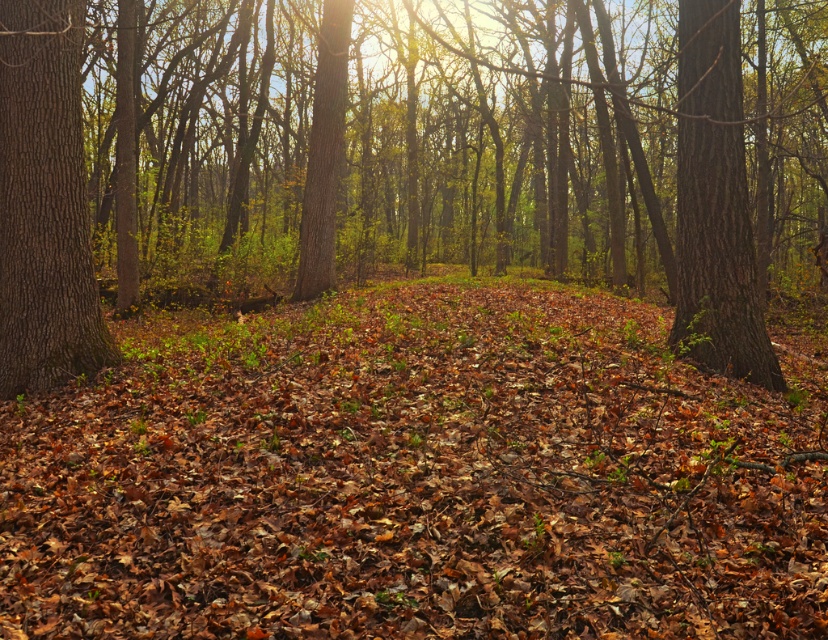
Looking at this image, you are standing in the forest and want to take a photo of the brown leaf litter at center. If your camera is 11.26 feet away from the leaf litter, will you need to zoom in or out to focus on the leaf litter?

The brown leaf litter at center and camera are 11.26 feet apart from each other, so you will need to zoom out to focus on the leaf litter since it is far away.

You are standing in the forest depicted in the scene. You notice a point marked at coordinates point (414, 476). What is located at that point?

At point (414, 476) lies brown leaf litter at center.